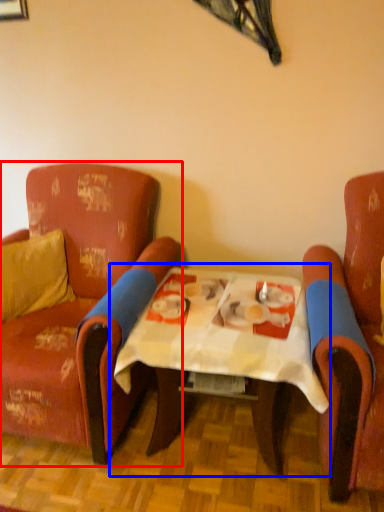
Question: Which object is further to the camera taking this photo, chair (highlighted by a red box) or table (highlighted by a blue box)?

Choices:
 (A) chair
 (B) table

Answer: (A)